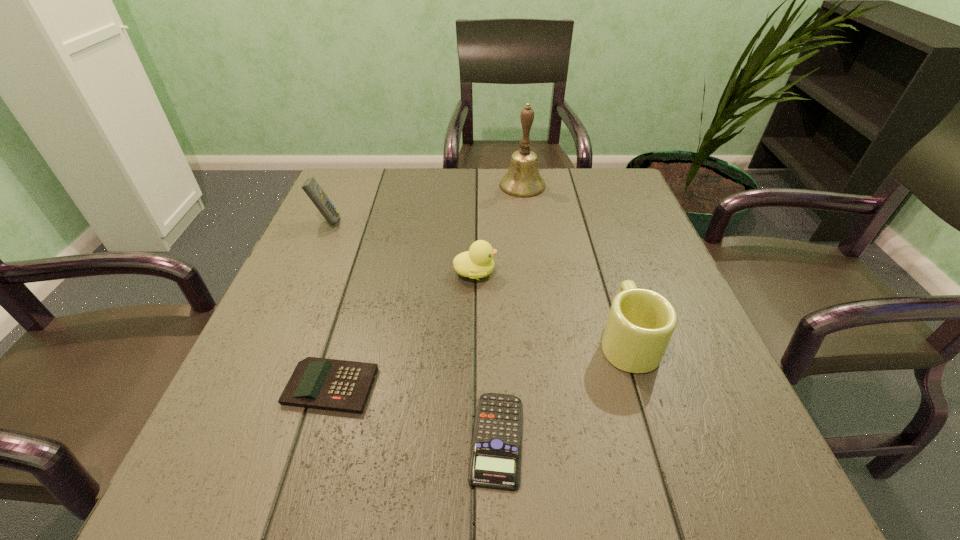
Find the location of `free spot between the tallest object and the fifth object from right to left`. free spot between the tallest object and the fifth object from right to left is located at coordinates (427, 286).

Find the location of a particular element. Image resolution: width=960 pixels, height=540 pixels. free space that is in between the bell and the fifth tallest object is located at coordinates (427, 286).

Identify the location of free space between the fourth nearest object and the bell. Image resolution: width=960 pixels, height=540 pixels. (499, 229).

At what (x,y) coordinates should I click in order to perform the action: click on vacant region between the third farthest object and the fifth object from right to left. Please return your answer as a coordinate pair (x, y). This screenshot has width=960, height=540. Looking at the image, I should click on (403, 329).

This screenshot has height=540, width=960. I want to click on free point between the leftmost object and the rightmost calculator, so tap(412, 330).

At what (x,y) coordinates should I click in order to perform the action: click on vacant area that lies between the farthest calculator and the rightmost object. Please return your answer as a coordinate pair (x, y). The image size is (960, 540). Looking at the image, I should click on (477, 281).

Image resolution: width=960 pixels, height=540 pixels. I want to click on empty space between the shortest object and the tallest object, so [510, 312].

Where is `empty location between the fifth tallest object and the duckling`? empty location between the fifth tallest object and the duckling is located at coordinates (403, 329).

Where is `blank region between the second object from left to right and the third shortest object`? This screenshot has width=960, height=540. blank region between the second object from left to right and the third shortest object is located at coordinates [x=403, y=329].

Image resolution: width=960 pixels, height=540 pixels. In order to click on free space between the shortest calculator and the tallest calculator in this screenshot , I will do tap(412, 330).